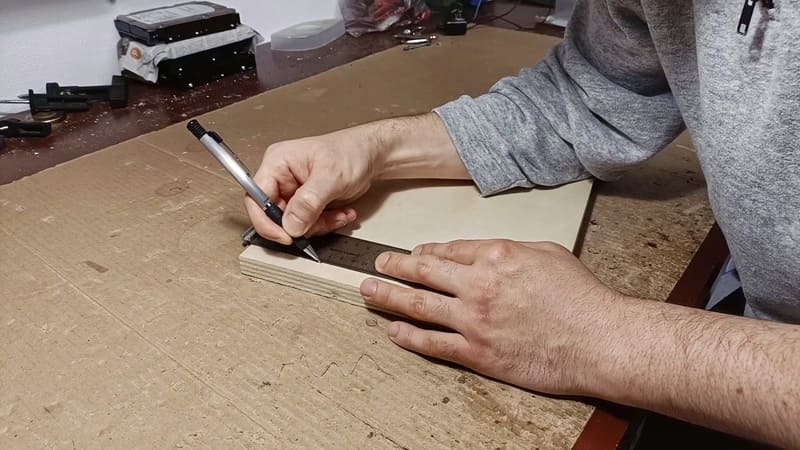
You are a GUI agent. You are given a task and a screenshot of the screen. Output one action in this format:
    pyautogui.click(x=<x>, y=<y>)
    Task: Click on the workbench
    This screenshot has height=450, width=800.
    Given the screenshot: What is the action you would take?
    pyautogui.click(x=66, y=141)